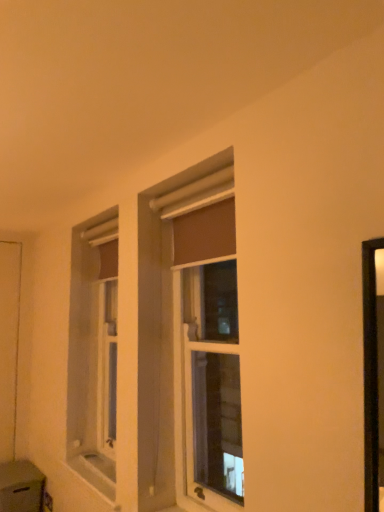
Question: From the image's perspective, is matte brown curtain at center beneath white matte screen door at left?

Choices:
 (A) no
 (B) yes

Answer: (A)

Question: Does matte brown curtain at center have a smaller size compared to white matte screen door at left?

Choices:
 (A) no
 (B) yes

Answer: (A)

Question: Is matte brown curtain at center taller than white matte screen door at left?

Choices:
 (A) yes
 (B) no

Answer: (B)

Question: Is matte brown curtain at center oriented towards white matte screen door at left?

Choices:
 (A) no
 (B) yes

Answer: (A)

Question: Can you confirm if matte brown curtain at center is shorter than white matte screen door at left?

Choices:
 (A) no
 (B) yes

Answer: (B)

Question: Is matte brown curtain at center thinner than white matte screen door at left?

Choices:
 (A) no
 (B) yes

Answer: (A)

Question: From the image's perspective, is white matte screen door at left located beneath matte brown curtain at center?

Choices:
 (A) yes
 (B) no

Answer: (A)

Question: Considering the relative sizes of white matte screen door at left and matte brown curtain at center in the image provided, is white matte screen door at left taller than matte brown curtain at center?

Choices:
 (A) no
 (B) yes

Answer: (B)

Question: From a real-world perspective, is white matte screen door at left located higher than matte brown curtain at center?

Choices:
 (A) yes
 (B) no

Answer: (B)

Question: Considering the relative sizes of white matte screen door at left and matte brown curtain at center in the image provided, is white matte screen door at left shorter than matte brown curtain at center?

Choices:
 (A) no
 (B) yes

Answer: (A)

Question: Is white matte screen door at left outside of matte brown curtain at center?

Choices:
 (A) yes
 (B) no

Answer: (A)

Question: Is white matte screen door at left thinner than matte brown curtain at center?

Choices:
 (A) yes
 (B) no

Answer: (A)

Question: Is white matte screen door at left wider or thinner than matte brown curtain at center?

Choices:
 (A) wide
 (B) thin

Answer: (B)